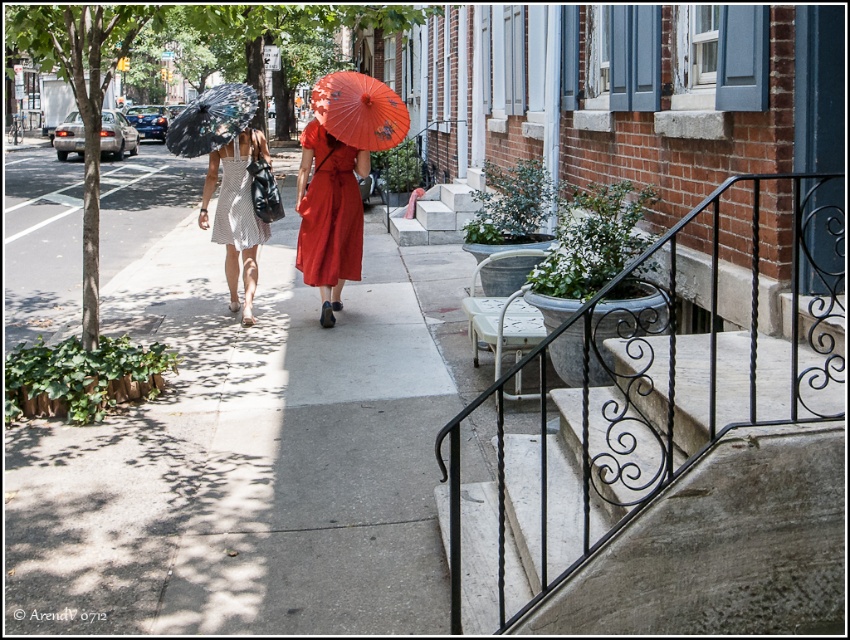
You are standing at the point marked by coordinates point [241,461]. Looking around, you see the gray concrete sidewalk at center. What is the name of the object you are standing on?

You are standing on the gray concrete sidewalk at center, which is represented by the point [241,461].

You are a delivery person trying to place a small package on the gray concrete sidewalk at center without blocking the matte red parasol at center. Considering their sizes, will the package fit on the sidewalk while keeping the parasol visible?

The gray concrete sidewalk at center is bigger than the matte red parasol at center, so the package can be placed on the gray concrete sidewalk at center while keeping the matte red parasol at center visible.

You are standing at the starting point and want to reach the destination point. The two points are located at coordinates point (225, 280) and point (230, 140). Which point should you head towards to reach your destination first?

Point (230, 140) is in front of point (225, 280), so you should head towards point (230, 140) to reach your destination first.